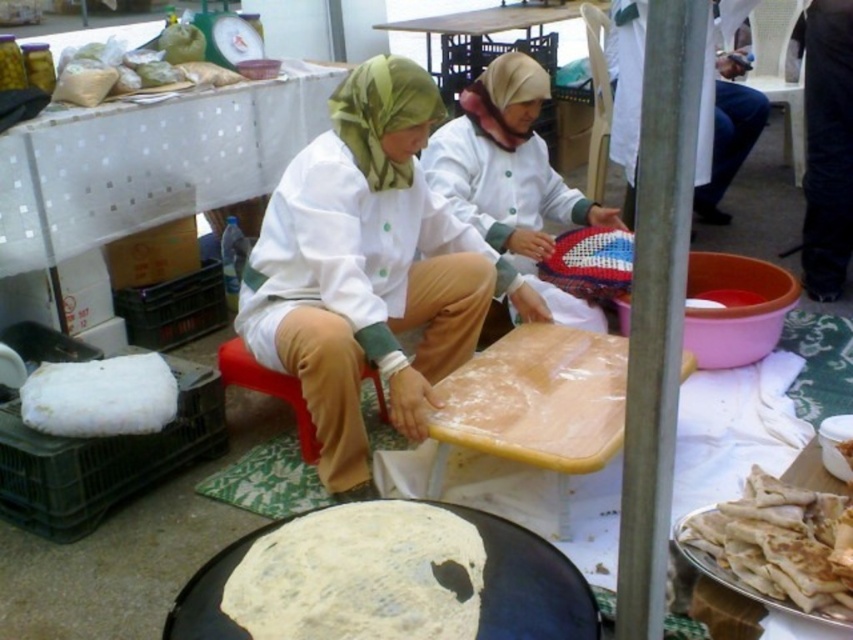
Is white plastic table at upper left behind white dough at center?

That is True.

Who is taller, white plastic table at upper left or white dough at center?

With more height is white plastic table at upper left.

Is point (254, 92) positioned in front of point (299, 566)?

No, it is behind (299, 566).

This screenshot has height=640, width=853. I want to click on white plastic table at upper left, so click(141, 170).

Is green silk headscarf at upper center below beige fabric headscarf at center?

Yes.

Who is more forward, (378,86) or (483,118)?

Positioned in front is point (378,86).

Identify the location of green silk headscarf at upper center. The image size is (853, 640). (383, 115).

Between white matte fabric at center and green silk headscarf at upper center, which one is positioned lower?

white matte fabric at center is below.

Is point (519, 208) positioned after point (415, 120)?

Yes, it is behind point (415, 120).

The height and width of the screenshot is (640, 853). In order to click on white matte fabric at center in this screenshot , I will do `click(512, 177)`.